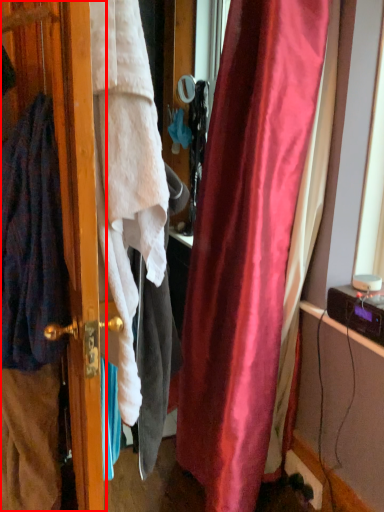
Question: Where is screen door (annotated by the red box) located in relation to cardigan in the image?

Choices:
 (A) right
 (B) left

Answer: (A)